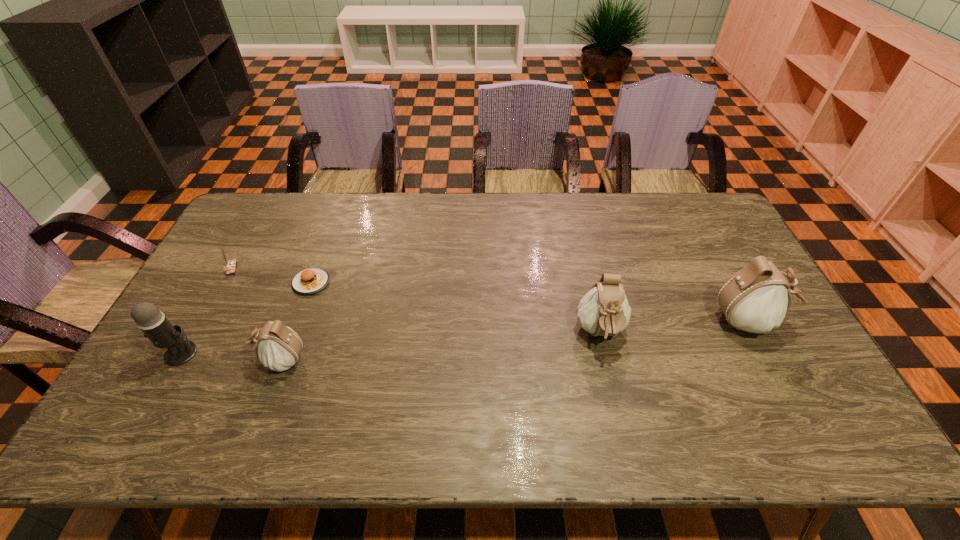
Please point a location where one more pouch can be added evenly. Please provide its 2D coordinates. Your answer should be formatted as a tuple, i.e. [(x, y)], where the tuple contains the x and y coordinates of a point satisfying the conditions above.

[(444, 346)]